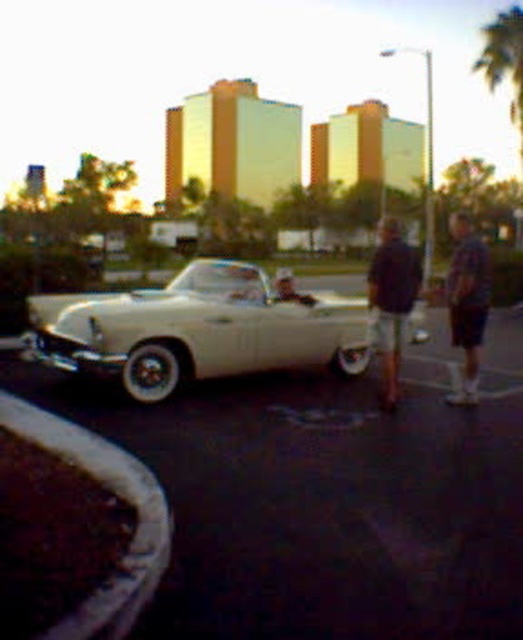
Question: Observing the image, what is the correct spatial positioning of dark brown shorts at center in reference to blue denim shorts at right?

Choices:
 (A) above
 (B) below

Answer: (B)

Question: Considering the real-world distances, which object is farthest from the matte black car at center?

Choices:
 (A) dark brown shorts at center
 (B) white glossy car at center

Answer: (A)

Question: Does dark brown shorts at center appear under matte black car at center?

Choices:
 (A) yes
 (B) no

Answer: (A)

Question: Does dark brown shorts at center appear under matte black car at center?

Choices:
 (A) no
 (B) yes

Answer: (B)

Question: Based on their relative distances, which object is nearer to the dark brown shorts at center?

Choices:
 (A) white glossy car at center
 (B) blue denim shorts at right
 (C) matte black car at center
 (D) white glossy convertible at center

Answer: (B)

Question: Based on their relative distances, which object is nearer to the dark brown shorts at center?

Choices:
 (A) blue denim shorts at right
 (B) matte black car at center
 (C) white glossy car at center
 (D) white glossy convertible at center

Answer: (A)